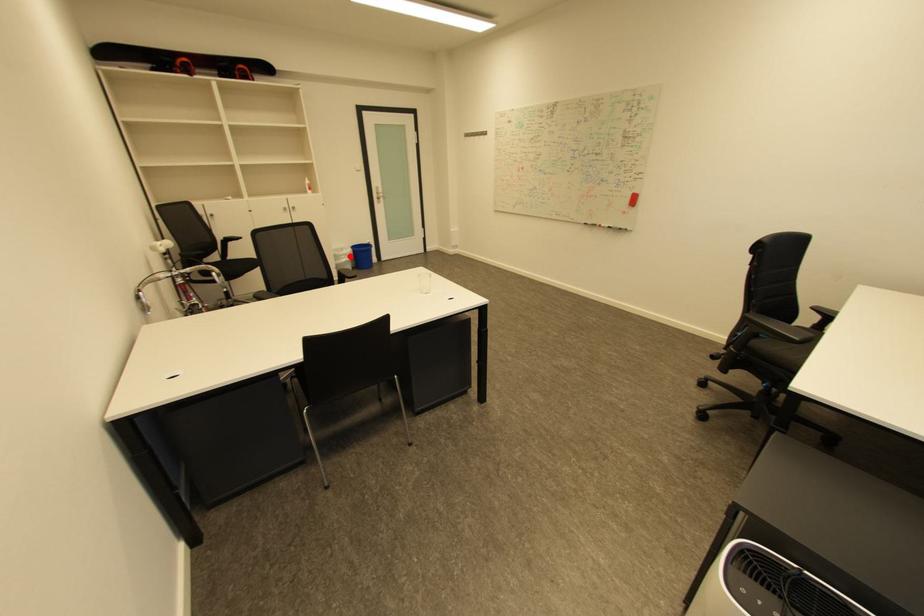
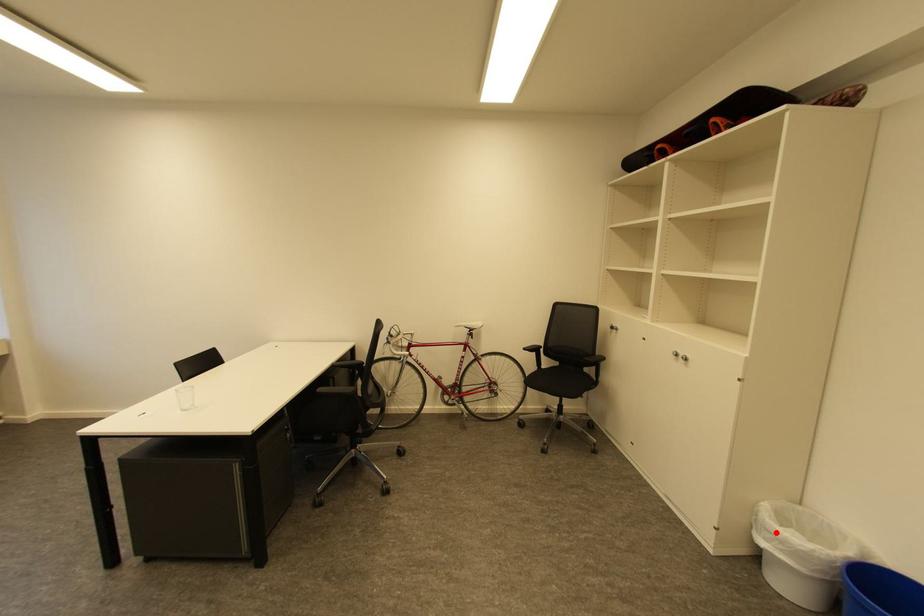
I am providing you with two images of the same scene from different viewpoints. A red point is marked on the first image and another point is marked on the second image. Is the marked point in image1 the same physical position as the marked point in image2?

Yes